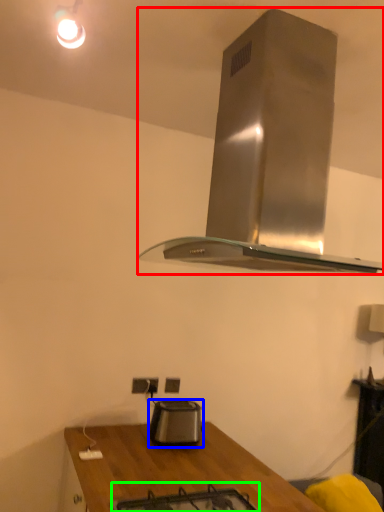
Question: Which object is positioned closest to home appliance (highlighted by a red box)? Select from kitchen appliance (highlighted by a blue box) and gas stove (highlighted by a green box).

Choices:
 (A) kitchen appliance
 (B) gas stove

Answer: (B)